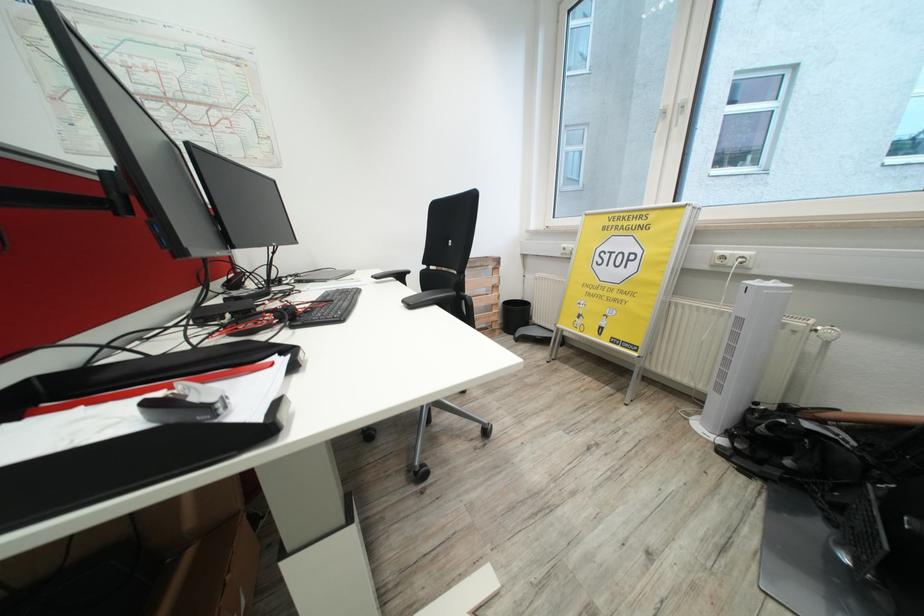
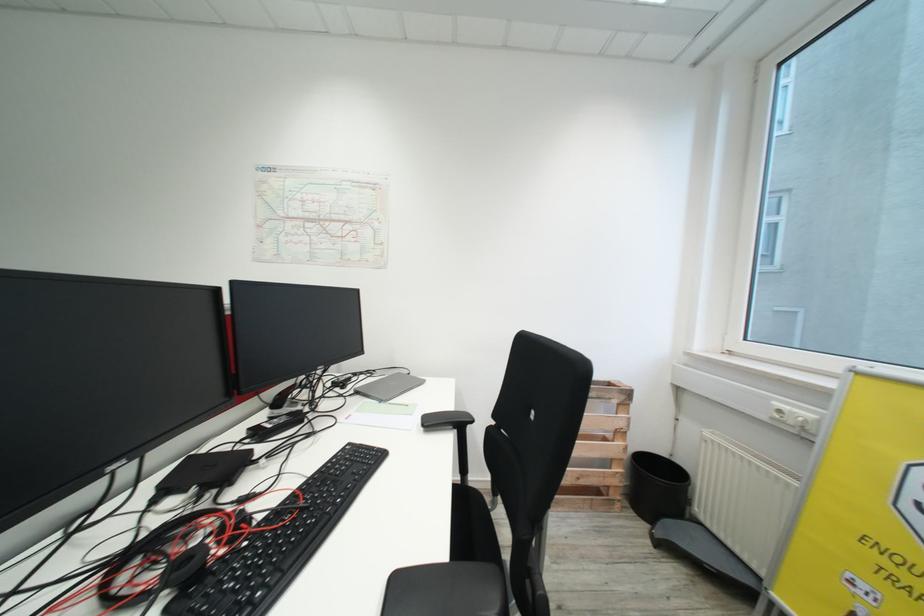
Question: The camera is either moving clockwise (left) or counter-clockwise (right) around the object. The first image is from the beginning of the video and the second image is from the end. Is the camera moving left or right when shooting the video?

Choices:
 (A) Left
 (B) Right

Answer: (B)